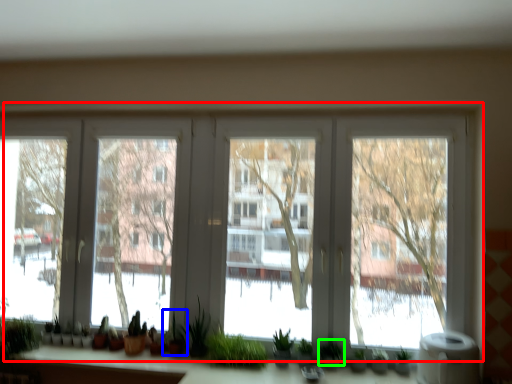
Question: Which is nearer to the window (highlighted by a red box)? plant (highlighted by a blue box) or plant (highlighted by a green box).

Choices:
 (A) plant
 (B) plant

Answer: (A)